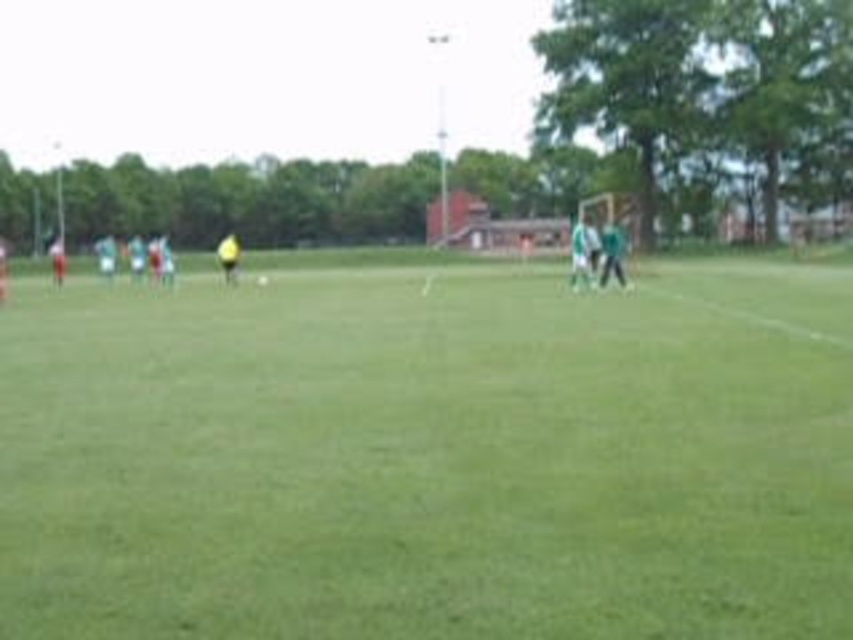
Does green grass field at center appear on the left side of yellow jersey at left?

In fact, green grass field at center is to the right of yellow jersey at left.

Is green grass field at center smaller than yellow jersey at left?

Correct, green grass field at center occupies less space than yellow jersey at left.

I want to click on green grass field at center, so click(x=430, y=454).

Who is higher up, green matte shirt at right or yellow matte soccer ball at center?

yellow matte soccer ball at center is higher up.

Between green matte shirt at right and yellow matte soccer ball at center, which one has more height?

yellow matte soccer ball at center

Who is more distant from viewer, (618, 250) or (233, 244)?

Point (233, 244)

Identify the location of green matte shirt at right. (611, 253).

You are a GUI agent. You are given a task and a screenshot of the screen. Output one action in this format:
    pyautogui.click(x=<x>, y=<y>)
    Task: Click on the green jersey at right
    The width and height of the screenshot is (853, 640).
    Given the screenshot: What is the action you would take?
    pyautogui.click(x=578, y=253)

Which is in front, point (573, 273) or point (59, 259)?

Point (573, 273) is more forward.

This screenshot has width=853, height=640. Find the location of `green jersey at right`. green jersey at right is located at coordinates (578, 253).